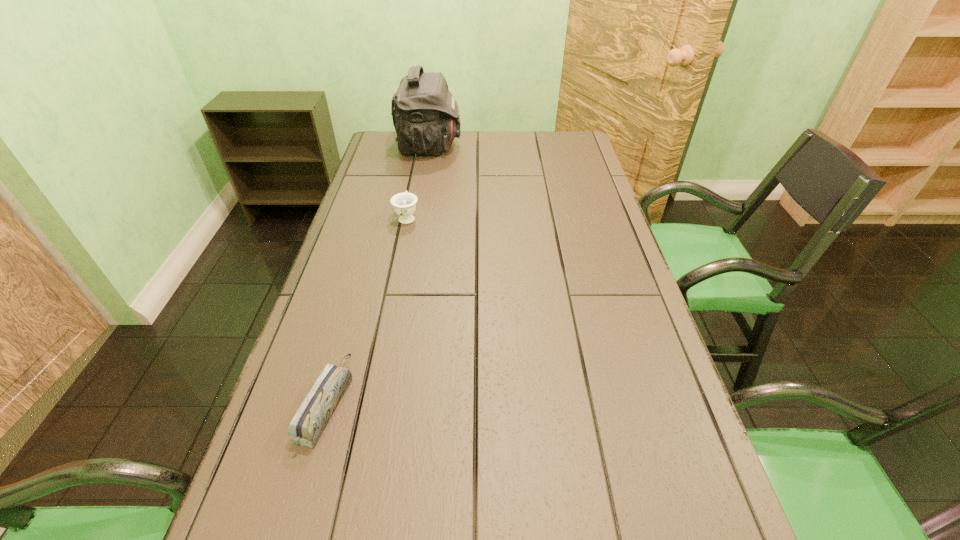
The height and width of the screenshot is (540, 960). In order to click on vacant space positioned 0.380m on the back of the shortest object in this screenshot , I will do `click(372, 248)`.

Identify the location of object that is at the far edge. (425, 114).

Identify the location of shoulder bag positioned at the left edge. The width and height of the screenshot is (960, 540). (425, 114).

You are a GUI agent. You are given a task and a screenshot of the screen. Output one action in this format:
    pyautogui.click(x=<x>, y=<y>)
    Task: Click on the teacup that is at the left edge
    
    Given the screenshot: What is the action you would take?
    pyautogui.click(x=404, y=204)

Image resolution: width=960 pixels, height=540 pixels. What are the coordinates of `pencil box that is at the left edge` in the screenshot? It's located at (306, 427).

This screenshot has height=540, width=960. In order to click on object present at the far left corner in this screenshot , I will do `click(425, 114)`.

Identify the location of free space at the left edge. This screenshot has width=960, height=540. (397, 187).

At what (x,y) coordinates should I click in order to perform the action: click on vacant position at the right edge of the desktop. Please return your answer as a coordinate pair (x, y). Image resolution: width=960 pixels, height=540 pixels. Looking at the image, I should click on (591, 191).

In the image, there is a desktop. What are the coordinates of `free region at the far left corner` in the screenshot? It's located at (390, 144).

Image resolution: width=960 pixels, height=540 pixels. In the image, there is a desktop. In order to click on vacant space at the far right corner in this screenshot , I will do `click(545, 135)`.